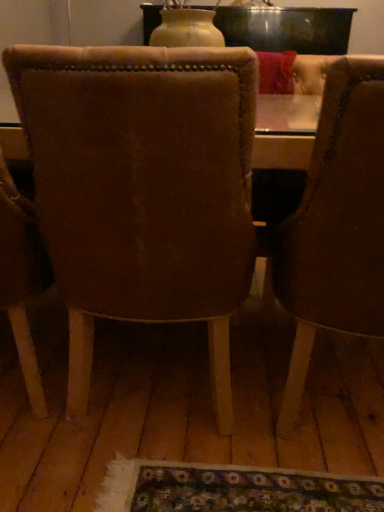
Question: Can you confirm if suede-like brown chair at center, the second chair in the right-to-left sequence, is thinner than brown leather chair at right, which is the 2th chair in left-to-right order?

Choices:
 (A) yes
 (B) no

Answer: (A)

Question: From the image's perspective, is suede-like brown chair at center, the second chair in the right-to-left sequence, located beneath brown leather chair at right, the 1th chair in the right-to-left sequence?

Choices:
 (A) no
 (B) yes

Answer: (A)

Question: Can you confirm if suede-like brown chair at center, the second chair in the right-to-left sequence, is positioned to the right of brown leather chair at right, which is the 2th chair in left-to-right order?

Choices:
 (A) no
 (B) yes

Answer: (A)

Question: Is suede-like brown chair at center, which is the 1th chair from left to right, far away from brown leather chair at right, the 1th chair in the right-to-left sequence?

Choices:
 (A) no
 (B) yes

Answer: (A)

Question: Is suede-like brown chair at center, which is the 1th chair from left to right, facing towards brown leather chair at right, which is the 2th chair in left-to-right order?

Choices:
 (A) no
 (B) yes

Answer: (A)

Question: Is suede-like brown chair at center, the second chair in the right-to-left sequence, shorter than brown leather chair at right, which is the 2th chair in left-to-right order?

Choices:
 (A) yes
 (B) no

Answer: (B)

Question: Considering the relative sizes of brown leather chair at right, which is the 2th chair in left-to-right order, and suede-like brown chair at center, the second chair in the right-to-left sequence, in the image provided, is brown leather chair at right, which is the 2th chair in left-to-right order, thinner than suede-like brown chair at center, the second chair in the right-to-left sequence,?

Choices:
 (A) yes
 (B) no

Answer: (B)

Question: Is brown leather chair at right, which is the 2th chair in left-to-right order, bigger than suede-like brown chair at center, which is the 1th chair from left to right?

Choices:
 (A) no
 (B) yes

Answer: (B)

Question: Could you tell me if brown leather chair at right, the 1th chair in the right-to-left sequence, is turned towards suede-like brown chair at center, which is the 1th chair from left to right?

Choices:
 (A) no
 (B) yes

Answer: (A)

Question: Does brown leather chair at right, the 1th chair in the right-to-left sequence, have a greater height compared to suede-like brown chair at center, which is the 1th chair from left to right?

Choices:
 (A) yes
 (B) no

Answer: (B)

Question: Is brown leather chair at right, which is the 2th chair in left-to-right order, positioned with its back to suede-like brown chair at center, which is the 1th chair from left to right?

Choices:
 (A) yes
 (B) no

Answer: (B)

Question: Is brown leather chair at right, which is the 2th chair in left-to-right order, not close to suede-like brown chair at center, the second chair in the right-to-left sequence?

Choices:
 (A) yes
 (B) no

Answer: (B)

Question: From the image's perspective, is brown leather chair at right, which is the 2th chair in left-to-right order, positioned above or below suede-like brown chair at center, the second chair in the right-to-left sequence?

Choices:
 (A) below
 (B) above

Answer: (A)